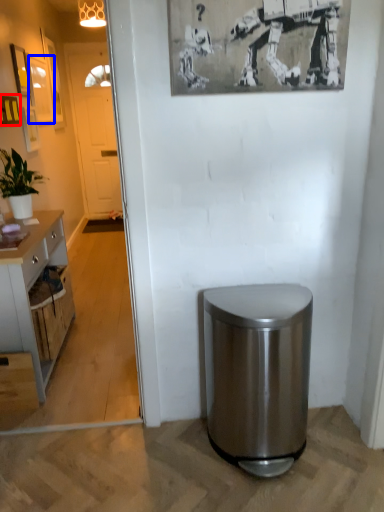
Question: Which object is closer to the camera taking this photo, picture frame (highlighted by a red box) or picture frame (highlighted by a blue box)?

Choices:
 (A) picture frame
 (B) picture frame

Answer: (A)